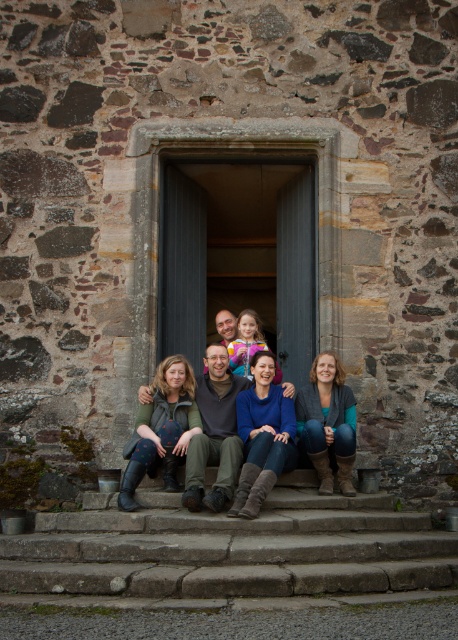
Between stone steps at center and blue denim jeans at center, which one has more height?

With more height is blue denim jeans at center.

Does stone steps at center have a smaller size compared to blue denim jeans at center?

Yes, stone steps at center is smaller than blue denim jeans at center.

Between point (58, 566) and point (224, 330), which one is positioned behind?

Point (224, 330)

At what (x,y) coordinates should I click in order to perform the action: click on stone steps at center. Please return your answer as a coordinate pair (x, y). The image size is (458, 640). Looking at the image, I should click on (225, 550).